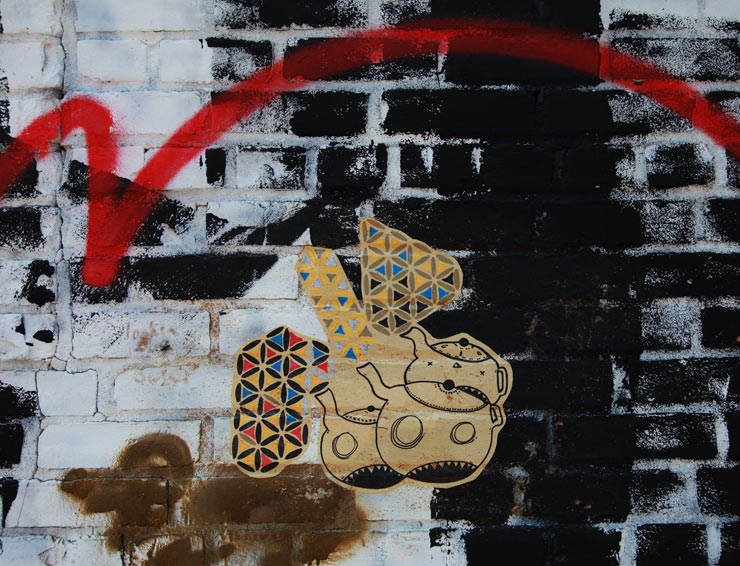
The image size is (740, 566). What are the coordinates of `teapot spout` in the screenshot? It's located at (336, 400), (371, 370), (411, 338).